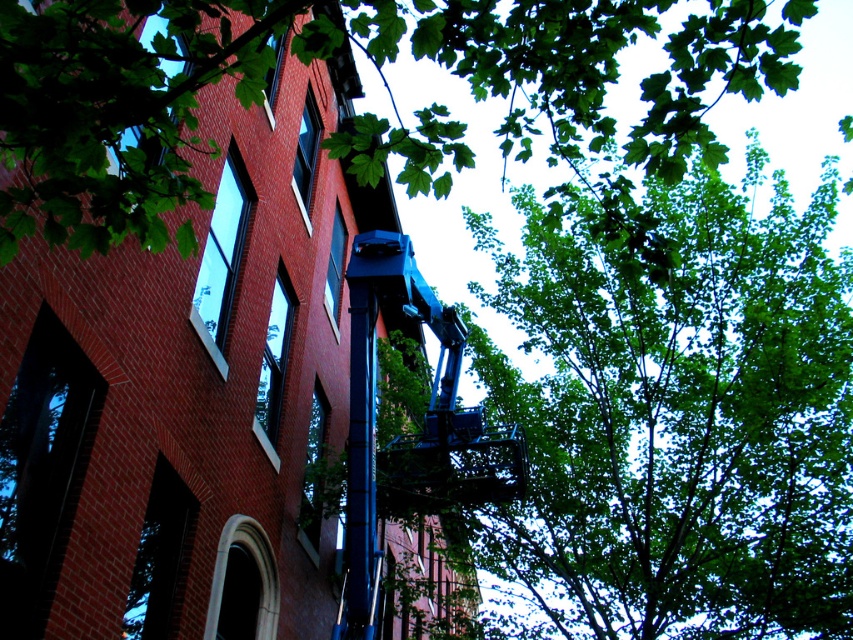
In the scene shown: You are a worker standing on the ground floor of the red brick building and you need to reach the green leafy tree at upper right. According to the coordinates provided, is the tree located in the upper right quadrant of the image?

Yes, the green leafy tree at upper right is located at coordinates point (675, 408), which falls within the upper right quadrant of the image.

You are standing in front of the red brick building and looking up at the blue hydraulic lift. There are two points marked on the lift arm. Which point is closer to you, point (695, 291) or point (381, 26)?

Point (695, 291) is further to the viewer than point (381, 26), so point (381, 26) is closer to you.

You are a worker on the blue hydraulic lift positioned against the building. You need to prune branches from both the green leafy tree at upper right and the green leafy tree at upper center. Based on their heights, which tree will require you to raise the lift higher?

The green leafy tree at upper right has a greater height compared to the green leafy tree at upper center, so you will need to raise the lift higher to prune its branches.